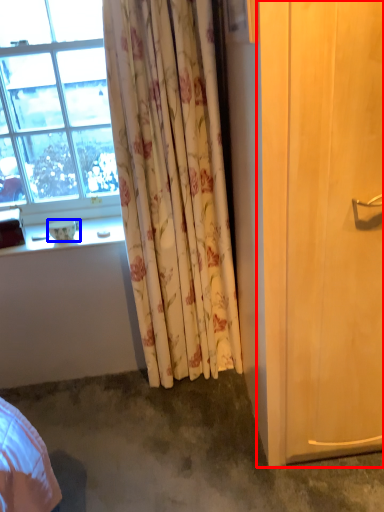
Question: Among these objects, which one is farthest to the camera, screen door (highlighted by a red box) or bowl (highlighted by a blue box)?

Choices:
 (A) screen door
 (B) bowl

Answer: (B)